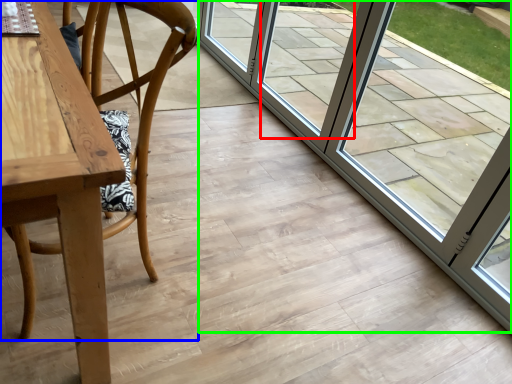
Question: Based on their relative distances, which object is nearer to window (highlighted by a red box)? Choose from chair (highlighted by a blue box) and door (highlighted by a green box).

Choices:
 (A) chair
 (B) door

Answer: (B)